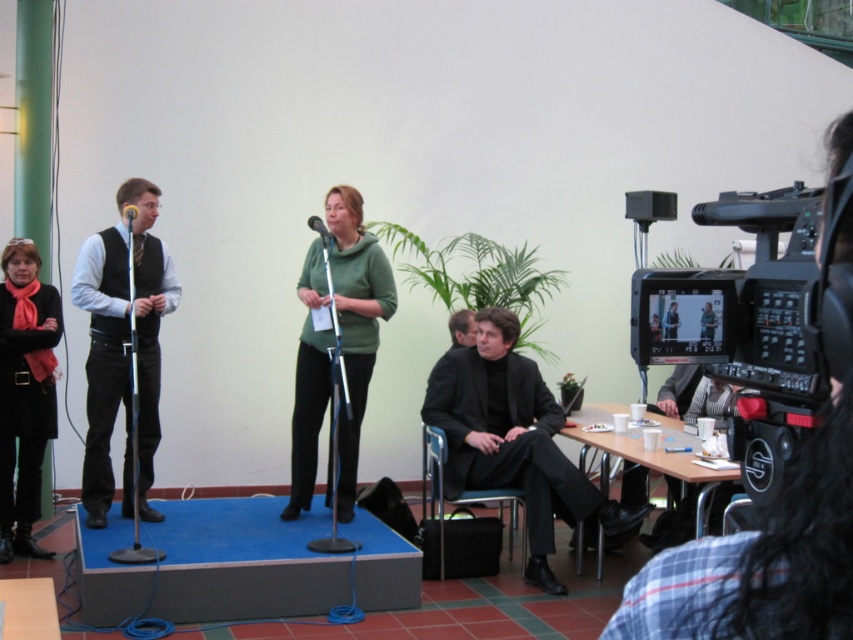
You are a stagehand who needs to retrieve the black wool coat at lower left from its current position to the matte black microphone at center. Given that you can only move in straight lines and the shortest path is 6.57 feet, is this distance within your 7 feet carrying capacity?

The distance between the black wool coat at lower left and the matte black microphone at center is 6.57 feet, which is within the 7 feet carrying capacity. Yes, you can move it directly.

You are an event planner trying to place a decorative item on the stage. The stage has a blue carpet and a dark gray base. You need to place the item exactly where the matte black vest at left is currently positioned. What are the coordinates for placing the item?

The coordinates for placing the item where the matte black vest at left is located are at point (x=103, y=365).